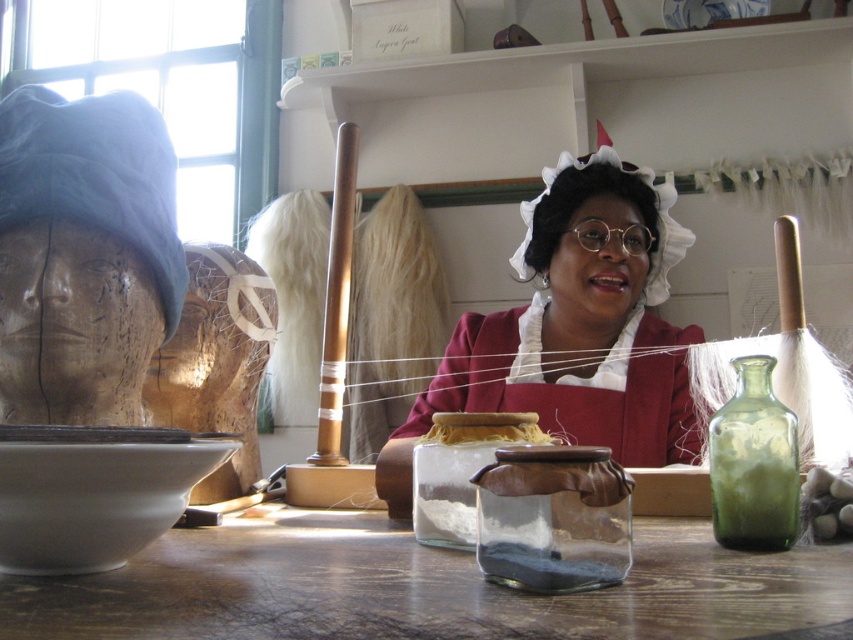
You are a visitor at the museum and want to take a photo of the transparent glass jar at center without any obstructions. Are there any objects between you and the jar that might block your view?

The transparent glass jar at center is located at point (422, 588), which means there are no objects between you and the jar, so you can take a clear photo without obstructions.

You are a visitor at the museum and want to take a photo of the transparent glass jar at center. The museum allows photos but requires that you do not get closer than 16 inches to any exhibit. Can you take the photo without violating the rule?

The transparent glass jar at center is 15.89 inches from the camera, which is less than the 16 inches minimum distance required by the museum. Therefore, taking a photo from this position would violate the rule. You need to step back to ensure you are at least 16 inches away.